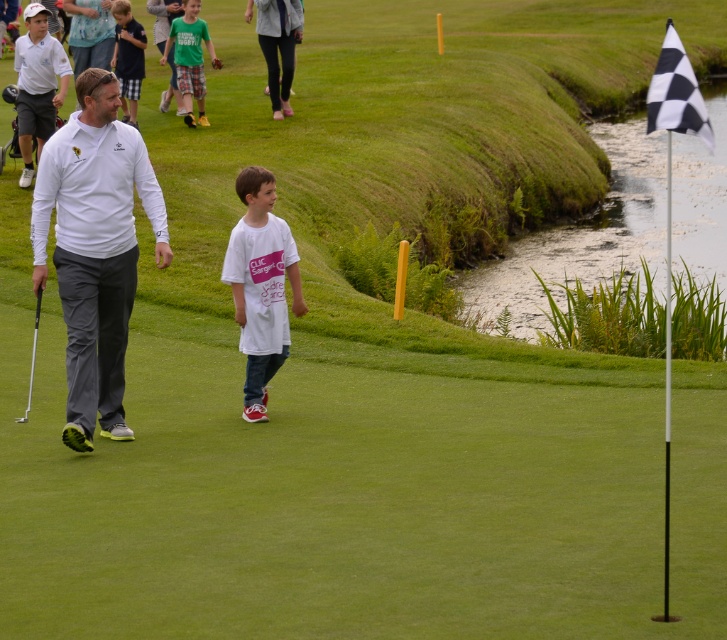
Question: Which of the following is the closest to the observer?

Choices:
 (A) (273, 355)
 (B) (129, 124)
 (C) (24, 419)

Answer: (C)

Question: Which object is the closest to the metallic silver golf club at left?

Choices:
 (A) green plaid shorts at upper center
 (B) dark blue shirt at center
 (C) white matte t-shirt at center
 (D) white matte shirt at upper center

Answer: (C)

Question: Can you confirm if white matte t-shirt at center is bigger than dark blue shirt at center?

Choices:
 (A) yes
 (B) no

Answer: (B)

Question: Is white matte golf club at center above green plaid shorts at upper center?

Choices:
 (A) yes
 (B) no

Answer: (B)

Question: Does white matte golf club at center have a greater width compared to white matte t-shirt at center?

Choices:
 (A) no
 (B) yes

Answer: (B)

Question: Which point is closer to the camera?

Choices:
 (A) metallic silver golf club at left
 (B) white matte shirt at upper center
 (C) green plaid shorts at upper center

Answer: (A)